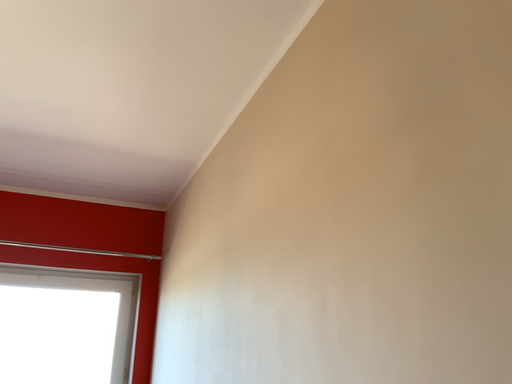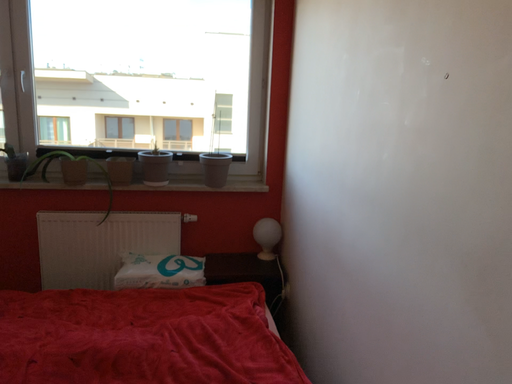
Question: How did the camera likely rotate when shooting the video?

Choices:
 (A) rotated right
 (B) rotated left

Answer: (B)